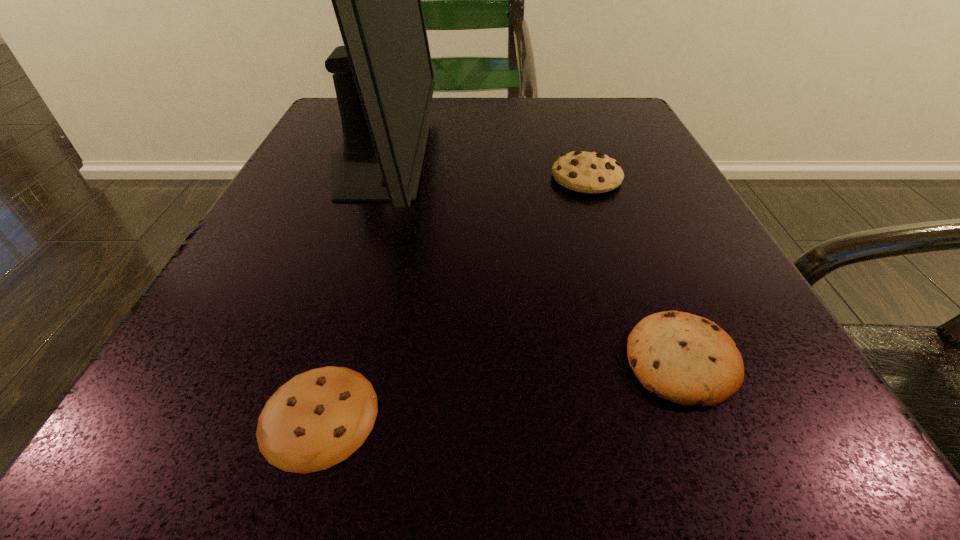
The width and height of the screenshot is (960, 540). Identify the location of vacant space at the near right corner of the desktop. (731, 433).

At what (x,y) coordinates should I click in order to perform the action: click on free area in between the computer monitor and the shortest cookie. Please return your answer as a coordinate pair (x, y). This screenshot has height=540, width=960. Looking at the image, I should click on (349, 287).

In order to click on unoccupied area between the farthest cookie and the computer monitor in this screenshot , I will do `click(483, 168)`.

Locate an element on the screen. The height and width of the screenshot is (540, 960). vacant space that's between the third tallest object and the shortest object is located at coordinates (500, 388).

At what (x,y) coordinates should I click in order to perform the action: click on free space between the shortest object and the farthest cookie. Please return your answer as a coordinate pair (x, y). Looking at the image, I should click on (452, 296).

At what (x,y) coordinates should I click in order to perform the action: click on vacant point located between the farthest cookie and the shortest object. Please return your answer as a coordinate pair (x, y). This screenshot has width=960, height=540. Looking at the image, I should click on (452, 296).

Identify the location of free space between the shortest object and the tallest cookie. The width and height of the screenshot is (960, 540). (452, 296).

Locate an element on the screen. free space between the computer monitor and the shortest cookie is located at coordinates (349, 287).

I want to click on free space between the shortest object and the farthest cookie, so click(x=452, y=296).

Where is `blank region between the shortest cookie and the second shortest cookie`? This screenshot has width=960, height=540. blank region between the shortest cookie and the second shortest cookie is located at coordinates (500, 388).